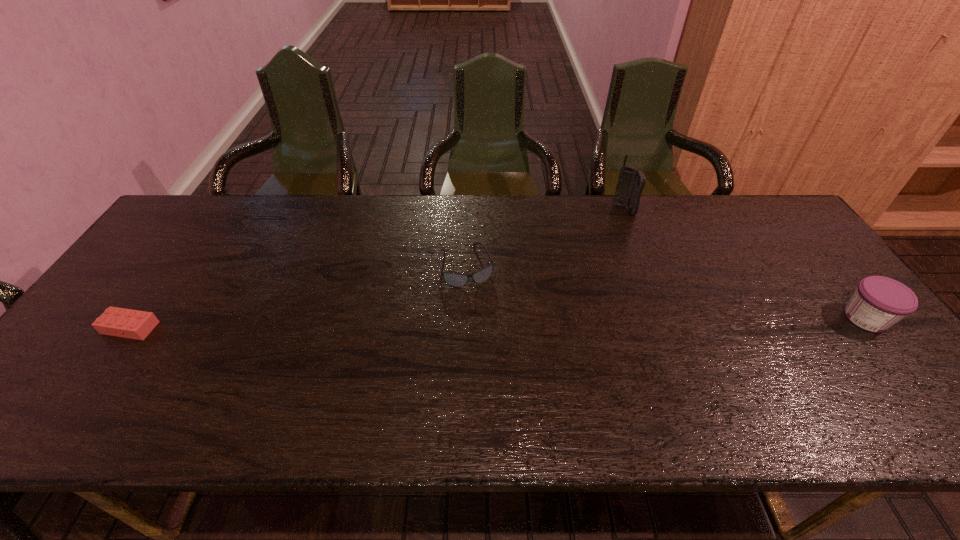
Where is `free space between the second shortest object and the second tallest object`? The width and height of the screenshot is (960, 540). free space between the second shortest object and the second tallest object is located at coordinates (666, 292).

I want to click on vacant area that lies between the second object from right to left and the second farthest object, so click(545, 238).

Where is `vacant area between the sunglasses and the tallest object`? vacant area between the sunglasses and the tallest object is located at coordinates (545, 238).

Locate an element on the screen. object identified as the closest to the farthest object is located at coordinates (453, 279).

Identify the location of the closest object to the jam. click(x=631, y=182).

The width and height of the screenshot is (960, 540). What are the coordinates of `free location that satisfies the following two spatial constraints: 1. on the front side of the rightmost object; 2. on the front label of the third nearest object` in the screenshot? It's located at (465, 318).

What are the coordinates of `vacant area in the image that satisfies the following two spatial constraints: 1. on the front side of the rightmost object; 2. on the front label of the third object from right to left` in the screenshot? It's located at (465, 318).

Locate an element on the screen. blank area in the image that satisfies the following two spatial constraints: 1. on the front side of the sunglasses; 2. on the front label of the second tallest object is located at coordinates (465, 318).